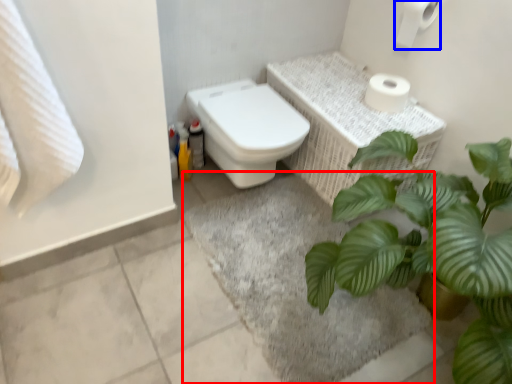
Question: Which point is closer to the camera, bath mat (highlighted by a red box) or toilet paper (highlighted by a blue box)?

Choices:
 (A) bath mat
 (B) toilet paper

Answer: (A)